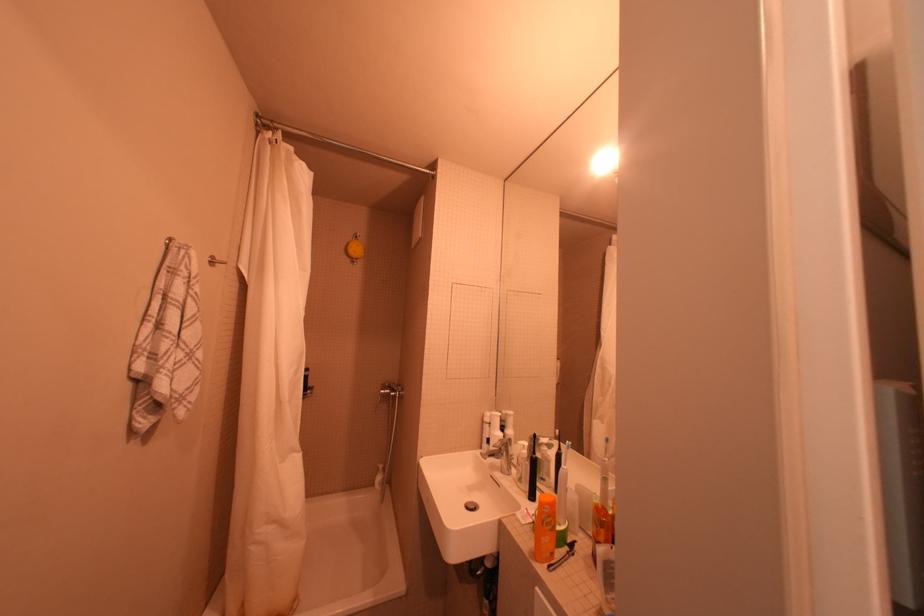
You are a GUI agent. You are given a task and a screenshot of the screen. Output one action in this format:
    pyautogui.click(x=<x>, y=<y>)
    Task: Click on the orange sunscreen bottle
    
    Given the screenshot: What is the action you would take?
    pyautogui.click(x=544, y=528)